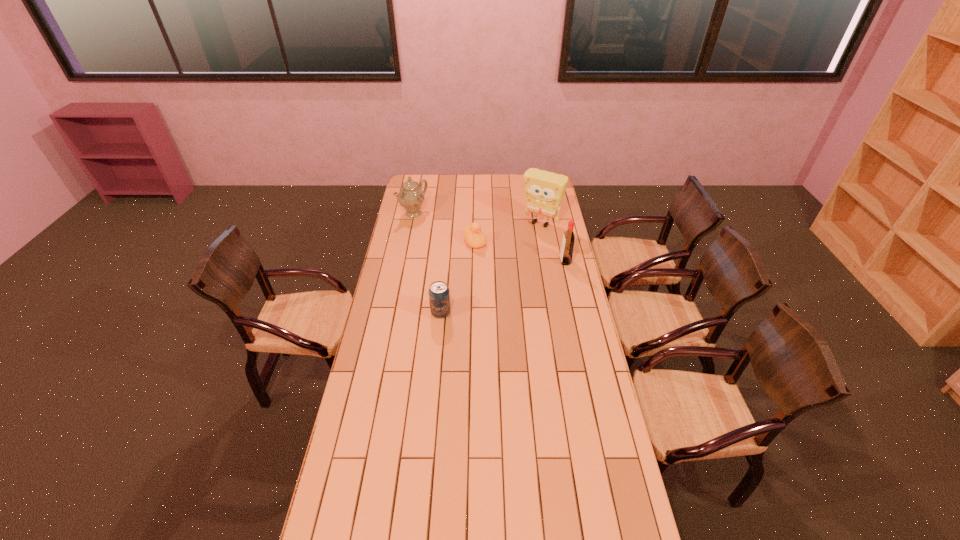
Locate an element on the screen. The width and height of the screenshot is (960, 540). object that is at the left edge is located at coordinates (411, 197).

At what (x,y) coordinates should I click in order to perform the action: click on vodka at the right edge. Please return your answer as a coordinate pair (x, y). Looking at the image, I should click on (566, 253).

Find the location of a particular element. The image size is (960, 540). sponge located in the right edge section of the desktop is located at coordinates (544, 191).

In the image, there is a desktop. Where is `free space at the far edge`? The image size is (960, 540). free space at the far edge is located at coordinates (439, 186).

Identify the location of free point at the left edge. This screenshot has height=540, width=960. (406, 260).

In the image, there is a desktop. At what (x,y) coordinates should I click in order to perform the action: click on vacant space at the right edge. Please return your answer as a coordinate pair (x, y). This screenshot has height=540, width=960. Looking at the image, I should click on (561, 362).

The width and height of the screenshot is (960, 540). In order to click on free space at the near left corner in this screenshot , I will do `click(345, 522)`.

Where is `vacant area at the near right corner`? vacant area at the near right corner is located at coordinates (611, 535).

The width and height of the screenshot is (960, 540). I want to click on free area in between the third nearest object and the chinaware, so click(x=444, y=228).

At what (x,y) coordinates should I click in order to perform the action: click on empty space that is in between the vodka and the sponge. Please return your answer as a coordinate pair (x, y). The height and width of the screenshot is (540, 960). Looking at the image, I should click on (553, 242).